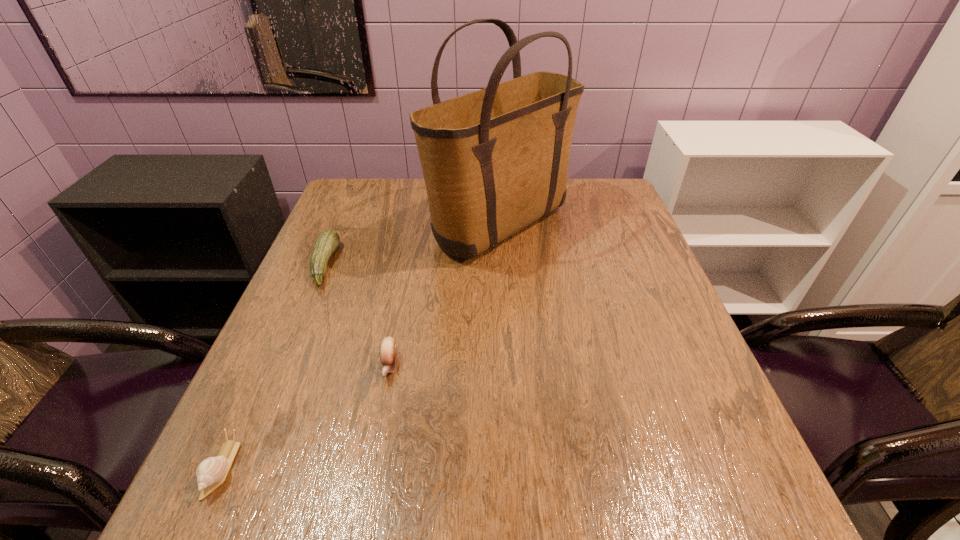
This screenshot has height=540, width=960. In the image, there is a desktop. In order to click on free space at the near left corner in this screenshot , I will do `click(213, 522)`.

In the image, there is a desktop. What are the coordinates of `vacant region at the far right corner` in the screenshot? It's located at (584, 187).

At what (x,y) coordinates should I click in order to perform the action: click on vacant space that's between the tote bag and the right escargot. Please return your answer as a coordinate pair (x, y). Image resolution: width=960 pixels, height=540 pixels. Looking at the image, I should click on coord(444,297).

Where is `free space between the shorter escargot and the zucchini`? The width and height of the screenshot is (960, 540). free space between the shorter escargot and the zucchini is located at coordinates (274, 366).

What are the coordinates of `vacant space in between the zucchini and the nearer escargot` in the screenshot? It's located at (274, 366).

The width and height of the screenshot is (960, 540). I want to click on vacant region between the tote bag and the zucchini, so click(412, 246).

At what (x,y) coordinates should I click in order to perform the action: click on vacant region between the nearer escargot and the zucchini. Please return your answer as a coordinate pair (x, y). Looking at the image, I should click on (274, 366).

The image size is (960, 540). Find the location of `free space between the shortest object and the taller escargot`. free space between the shortest object and the taller escargot is located at coordinates (305, 417).

I want to click on vacant area that lies between the third farthest object and the shorter escargot, so click(x=305, y=417).

This screenshot has width=960, height=540. Find the location of `free spot between the third farthest object and the zucchini`. free spot between the third farthest object and the zucchini is located at coordinates (357, 315).